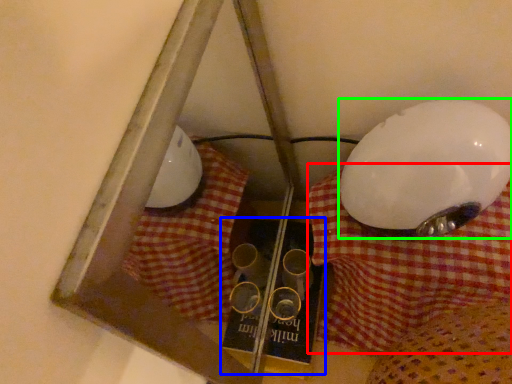
Question: Which is farther away from tablecloth (highlighted by a red box)? book (highlighted by a blue box) or lamp (highlighted by a green box)?

Choices:
 (A) book
 (B) lamp

Answer: (A)